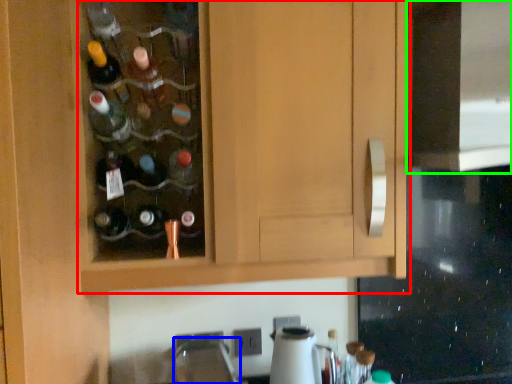
Question: Which object is the farthest from cabinetry (highlighted by a red box)? Choose among these: faucet (highlighted by a blue box) or oven (highlighted by a green box).

Choices:
 (A) faucet
 (B) oven

Answer: (A)